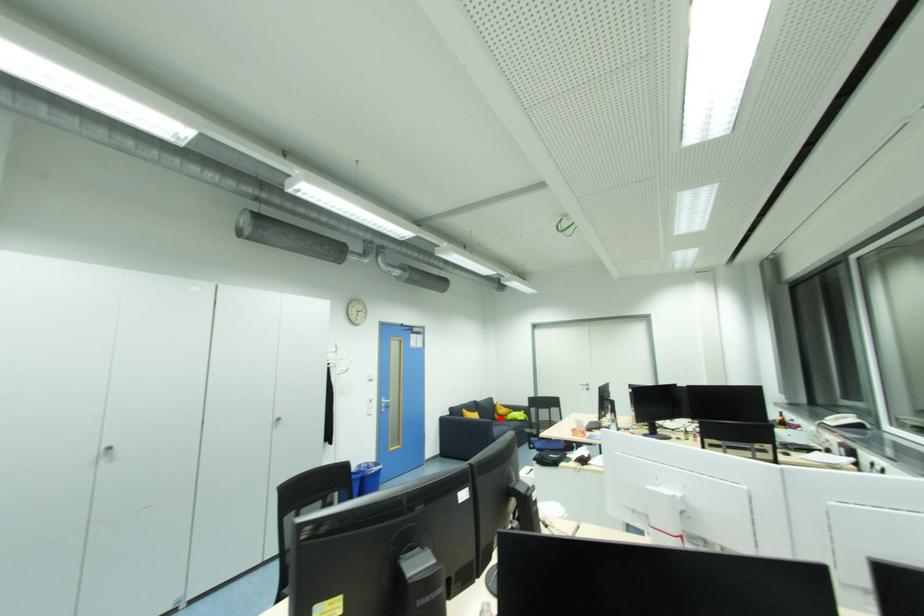
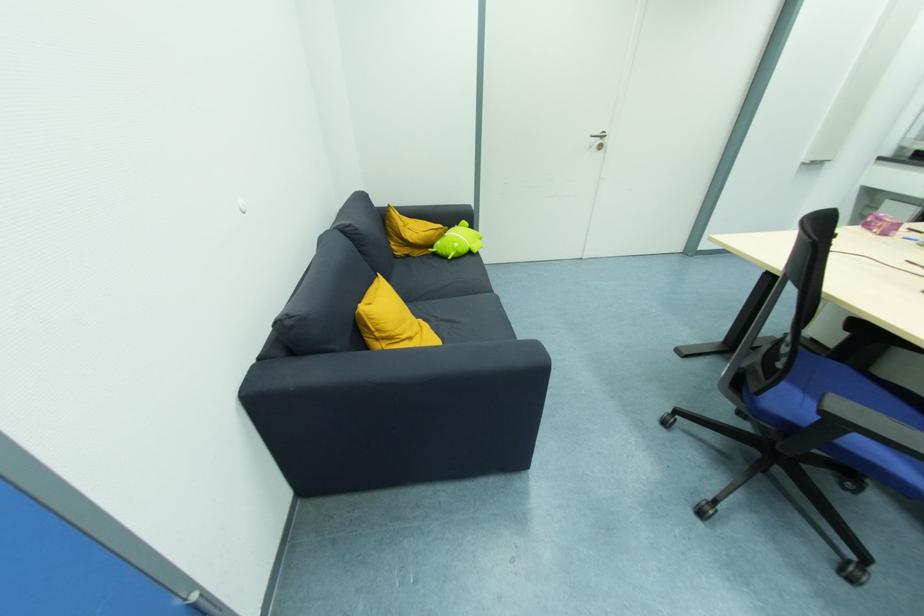
The point at the highlighted location is marked in the first image. Where is the corresponding point in the second image?

(403, 253)